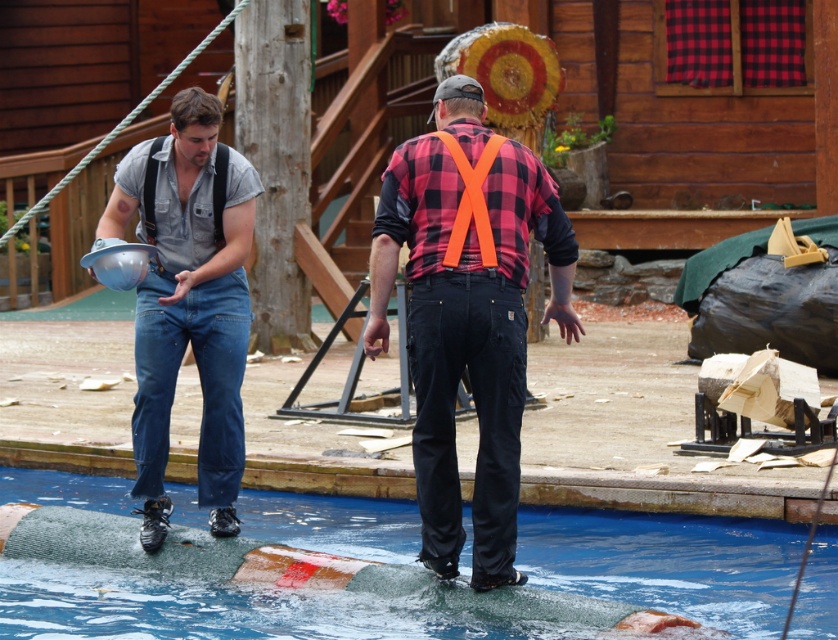
You are a judge at the lumberjack competition. You need to determine if the blue rubber mat at lower center can fit entirely under the plaid fabric shirt at center. Can it?

The blue rubber mat at lower center is shorter than the plaid fabric shirt at center, so it can fit entirely under it.

You are a photographer positioned at the front of the competition area. You want to take a photo of the two men on the platform. Which object, the plaid fabric shirt at center or the black fabric suspenders at left, will appear larger in your photo?

The plaid fabric shirt at center will appear larger in the photo because it is closer to the viewer than the black fabric suspenders at left.

You are a judge at the lumberjack competition. You need to determine which participant is taller based on their clothing. Which is taller, the plaid fabric shirt at center or the black fabric suspenders at left?

The plaid fabric shirt at center is much taller than the black fabric suspenders at left, so the plaid fabric shirt at center is taller.